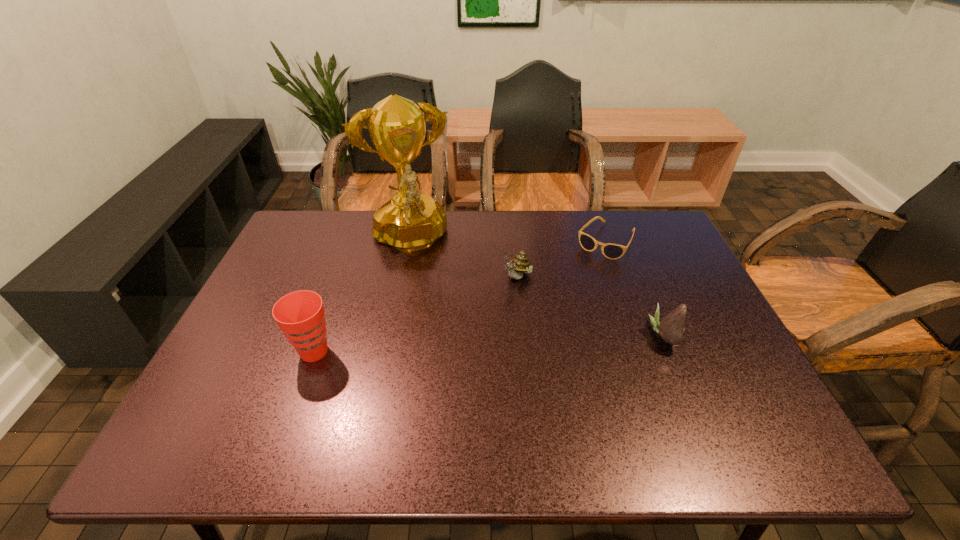
In order to click on object positioned at the far right corner in this screenshot , I will do `click(611, 251)`.

This screenshot has height=540, width=960. Identify the location of free location at the far edge. (353, 212).

In the image, there is a desktop. In order to click on vacant area at the near edge in this screenshot , I will do `click(511, 402)`.

Locate an element on the screen. free location at the left edge is located at coordinates (255, 350).

Where is `vacant position at the far left corner of the desktop`? Image resolution: width=960 pixels, height=540 pixels. vacant position at the far left corner of the desktop is located at coordinates (292, 242).

Where is `vacant space at the far right corner of the desktop`? vacant space at the far right corner of the desktop is located at coordinates (640, 215).

The width and height of the screenshot is (960, 540). In the image, there is a desktop. Identify the location of vacant space at the near right corner. (752, 414).

The width and height of the screenshot is (960, 540). I want to click on vacant region between the snail and the cup, so click(416, 315).

The height and width of the screenshot is (540, 960). Identify the location of vacant space that's between the second tallest object and the avocado. (489, 343).

Where is `empty location between the cup and the award`? The height and width of the screenshot is (540, 960). empty location between the cup and the award is located at coordinates (362, 296).